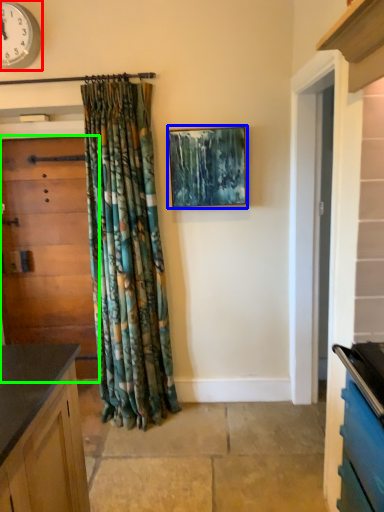
Question: Estimate the real-world distances between objects in this image. Which object is closer to clock (highlighted by a red box), picture frame (highlighted by a blue box) or door (highlighted by a green box)?

Choices:
 (A) picture frame
 (B) door

Answer: (B)